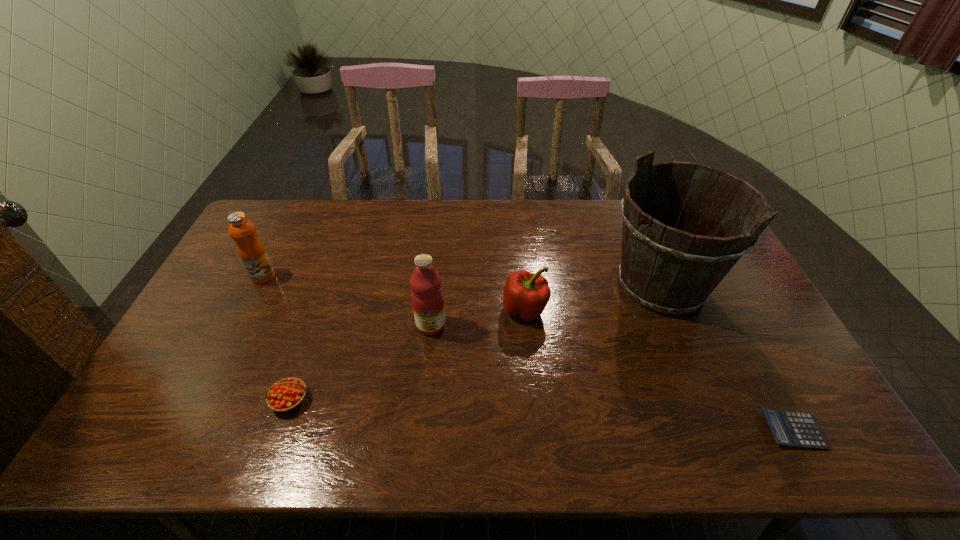
Locate an element on the screen. the tallest object is located at coordinates (668, 266).

At what (x,y) coordinates should I click in order to perform the action: click on the right fruit juice. Please return your answer as a coordinate pair (x, y). Looking at the image, I should click on (427, 296).

Identify the location of the fourth object from right to left. (427, 296).

Find the location of a particular element. the left fruit juice is located at coordinates (252, 252).

The image size is (960, 540). Find the location of `the leftmost object`. the leftmost object is located at coordinates (252, 252).

You are a GUI agent. You are given a task and a screenshot of the screen. Output one action in this format:
    pyautogui.click(x=<x>, y=<y>)
    Task: Click on the third shortest object
    
    Given the screenshot: What is the action you would take?
    pyautogui.click(x=525, y=294)

Where is `the fourth object from left to right`? the fourth object from left to right is located at coordinates (525, 294).

Identify the location of the second shortest object. This screenshot has width=960, height=540. (287, 394).

Where is `strawberry`? This screenshot has height=540, width=960. strawberry is located at coordinates (287, 394).

Find the location of `calculator`. calculator is located at coordinates (790, 428).